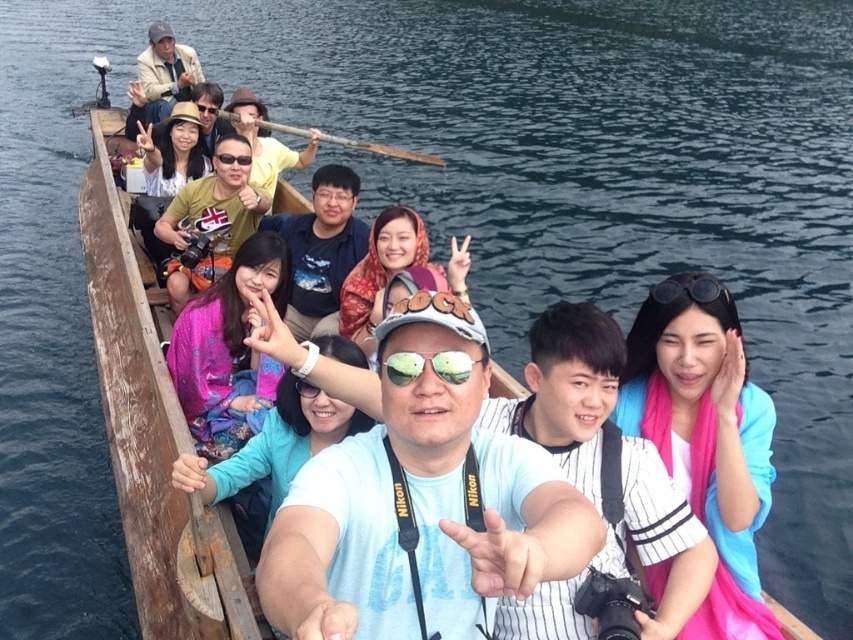
You are a photographer on the boat and want to take a photo of the matte pink scarf at center. However, your matte black camera at center is blocking the view. Which direction should you move the camera to get an unobstructed view of the scarf?

You should move the matte black camera at center to the right, since it is currently to the left of the matte pink scarf at center, allowing you to see the scarf without obstruction.

You are standing on the boat and want to place a small item exactly at the center of the blue fabric at center. According to the coordinates provided, where should you place it?

The blue fabric at center is located at point (274, 445), so you should place the item at those coordinates to position it exactly at the center of the blue fabric at center.

You are a photographer on the boat and need to capture both the blue fabric at center and the matte black sunglasses at upper center in a single shot. Which object should you focus on first to ensure both are in frame?

The blue fabric at center is larger in size than the matte black sunglasses at upper center, so you should focus on the blue fabric at center first to ensure both fit within the frame.